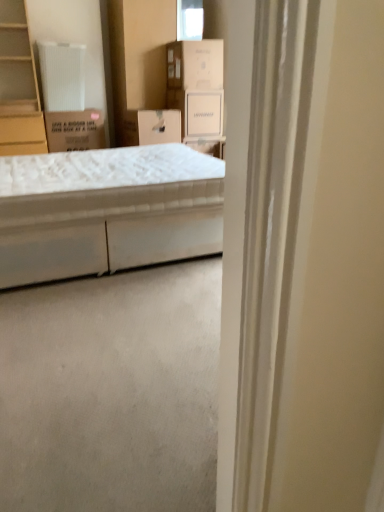
How much space does brown cardboard box at upper left, marked as the second cardboard box in a right-to-left arrangement, occupy vertically?

brown cardboard box at upper left, marked as the second cardboard box in a right-to-left arrangement, is 42.87 centimeters tall.

Locate an element on the screen. This screenshot has width=384, height=512. brown cardboard box at upper left, which is counted as the first cardboard box, starting from the left is located at coordinates (75, 130).

Locate an element on the screen. This screenshot has height=512, width=384. light brown wood cabinet at left is located at coordinates (18, 85).

What is the approximate height of white fabric bed at center?

21.80 inches.

The height and width of the screenshot is (512, 384). What do you see at coordinates (204, 113) in the screenshot? I see `white cardboard box at upper center, which appears as the 2th storage box when viewed from the left` at bounding box center [204, 113].

The height and width of the screenshot is (512, 384). Find the location of `white cardboard box at center, the first storage box from the left`. white cardboard box at center, the first storage box from the left is located at coordinates (159, 126).

Which object is positioned more to the right, white cardboard box at center, the first storage box from the left, or white fabric bed at center?

Positioned to the right is white cardboard box at center, the first storage box from the left.

Which of these two, white cardboard box at center, which is the 2th storage box in right-to-left order, or white fabric bed at center, is thinner?

Thinner between the two is white cardboard box at center, which is the 2th storage box in right-to-left order.

Is white cardboard box at upper center, which is the 2th cardboard box in left-to-right order, at the back of white cardboard box at upper center, which appears as the 1th storage box when viewed from the right?

No, white cardboard box at upper center, which appears as the 1th storage box when viewed from the right,'s orientation is not away from white cardboard box at upper center, which is the 2th cardboard box in left-to-right order.

From a real-world perspective, is white cardboard box at upper center, which appears as the 1th storage box when viewed from the right, positioned above or below white cardboard box at upper center, the 1th cardboard box from the right?

Clearly, from a real-world perspective, white cardboard box at upper center, which appears as the 1th storage box when viewed from the right, is below white cardboard box at upper center, the 1th cardboard box from the right.

This screenshot has height=512, width=384. Find the location of `the 1st cardboard box counting from the left side of the white cardboard box at upper center, which appears as the 2th storage box when viewed from the left`. the 1st cardboard box counting from the left side of the white cardboard box at upper center, which appears as the 2th storage box when viewed from the left is located at coordinates (195, 64).

Which is more to the right, white cardboard box at upper center, which appears as the 2th storage box when viewed from the left, or white cardboard box at upper center, the 2th cardboard box in the bottom-to-top sequence?

white cardboard box at upper center, which appears as the 2th storage box when viewed from the left, is more to the right.

Between white cardboard box at upper center, positioned as the first cardboard box in top-to-bottom order, and brown cardboard box at upper left, marked as the second cardboard box in a right-to-left arrangement, which one has smaller size?

white cardboard box at upper center, positioned as the first cardboard box in top-to-bottom order.

From the image's perspective, is white cardboard box at upper center, the 2th cardboard box in the bottom-to-top sequence, positioned above or below brown cardboard box at upper left, marked as the second cardboard box in a right-to-left arrangement?

Based on their image positions, white cardboard box at upper center, the 2th cardboard box in the bottom-to-top sequence, is located above brown cardboard box at upper left, marked as the second cardboard box in a right-to-left arrangement.

Identify the location of cardboard box behind the white cardboard box at upper center, which is the 2th cardboard box in left-to-right order. The height and width of the screenshot is (512, 384). (75, 130).

Is white cardboard box at upper center, the 2th cardboard box in the bottom-to-top sequence, not inside brown cardboard box at upper left, marked as the second cardboard box in a right-to-left arrangement?

Indeed, white cardboard box at upper center, the 2th cardboard box in the bottom-to-top sequence, is completely outside brown cardboard box at upper left, marked as the second cardboard box in a right-to-left arrangement.

Is light brown wood cabinet at left far from white fabric bed at center?

Indeed, light brown wood cabinet at left is not near white fabric bed at center.

Is light brown wood cabinet at left bigger than white fabric bed at center?

No, light brown wood cabinet at left is not bigger than white fabric bed at center.

Is light brown wood cabinet at left positioned with its back to white fabric bed at center?

No, white fabric bed at center is not at the back of light brown wood cabinet at left.

From the image's perspective, which one is positioned lower, light brown wood cabinet at left or brown cardboard box at upper left, which is counted as the first cardboard box, starting from the left?

brown cardboard box at upper left, which is counted as the first cardboard box, starting from the left, appears lower in the image.

Between light brown wood cabinet at left and brown cardboard box at upper left, the second cardboard box positioned from the top, which one has smaller width?

Thinner between the two is brown cardboard box at upper left, the second cardboard box positioned from the top.

In terms of height, does light brown wood cabinet at left look taller or shorter compared to brown cardboard box at upper left, the first cardboard box from the bottom?

Considering their sizes, light brown wood cabinet at left has more height than brown cardboard box at upper left, the first cardboard box from the bottom.

Between light brown wood cabinet at left and brown cardboard box at upper left, the first cardboard box from the bottom, which one appears on the right side from the viewer's perspective?

brown cardboard box at upper left, the first cardboard box from the bottom.

From the image's perspective, which object appears higher, light brown wood cabinet at left or white cardboard box at center, which is the 2th storage box in right-to-left order?

From the image's view, light brown wood cabinet at left is above.

Do you think light brown wood cabinet at left is within white cardboard box at center, the first storage box from the left, or outside of it?

light brown wood cabinet at left is outside white cardboard box at center, the first storage box from the left.

Does light brown wood cabinet at left have a larger size compared to white cardboard box at center, which is the 2th storage box in right-to-left order?

Indeed, light brown wood cabinet at left has a larger size compared to white cardboard box at center, which is the 2th storage box in right-to-left order.

Between white cardboard box at center, which is the 2th storage box in right-to-left order, and white cardboard box at upper center, which appears as the 2th storage box when viewed from the left, which one has smaller size?

Smaller between the two is white cardboard box at upper center, which appears as the 2th storage box when viewed from the left.

From the image's perspective, which one is positioned higher, white cardboard box at center, the first storage box from the left, or white cardboard box at upper center, which appears as the 2th storage box when viewed from the left?

white cardboard box at upper center, which appears as the 2th storage box when viewed from the left, is shown above in the image.

Does white cardboard box at center, which is the 2th storage box in right-to-left order, have a lesser height compared to white cardboard box at upper center, which appears as the 2th storage box when viewed from the left?

Yes, white cardboard box at center, which is the 2th storage box in right-to-left order, is shorter than white cardboard box at upper center, which appears as the 2th storage box when viewed from the left.

Is white cardboard box at center, the first storage box from the left, spatially inside white cardboard box at upper center, which appears as the 2th storage box when viewed from the left, or outside of it?

white cardboard box at center, the first storage box from the left, lies outside white cardboard box at upper center, which appears as the 2th storage box when viewed from the left.

You are a GUI agent. You are given a task and a screenshot of the screen. Output one action in this format:
    pyautogui.click(x=<x>, y=<y>)
    Task: Click on the bed in front of the white cardboard box at center, the first storage box from the left
    
    Given the screenshot: What is the action you would take?
    pyautogui.click(x=107, y=211)

The width and height of the screenshot is (384, 512). Find the location of `storage box located on the right of white cardboard box at upper center, positioned as the first cardboard box in top-to-bottom order`. storage box located on the right of white cardboard box at upper center, positioned as the first cardboard box in top-to-bottom order is located at coordinates (204, 113).

From the picture: Estimate the real-world distances between objects in this image. Which object is closer to white fabric bed at center, white cardboard box at upper center, which is the 2th cardboard box in left-to-right order, or brown cardboard box at upper left, the second cardboard box positioned from the top?

brown cardboard box at upper left, the second cardboard box positioned from the top, is positioned closer to the anchor white fabric bed at center.

Based on their spatial positions, is white fabric bed at center or brown cardboard box at upper left, marked as the second cardboard box in a right-to-left arrangement, further from white cardboard box at upper center, the 1th cardboard box from the right?

white fabric bed at center is further to white cardboard box at upper center, the 1th cardboard box from the right.

Looking at the image, which one is located further to white cardboard box at upper center, which appears as the 1th storage box when viewed from the right, white cardboard box at center, the first storage box from the left, or light brown wood cabinet at left?

light brown wood cabinet at left lies further to white cardboard box at upper center, which appears as the 1th storage box when viewed from the right, than the other object.

Estimate the real-world distances between objects in this image. Which object is closer to white fabric bed at center, white cardboard box at center, which is the 2th storage box in right-to-left order, or light brown wood cabinet at left?

white cardboard box at center, which is the 2th storage box in right-to-left order, lies closer to white fabric bed at center than the other object.

Estimate the real-world distances between objects in this image. Which object is further from light brown wood cabinet at left, white cardboard box at upper center, which appears as the 2th storage box when viewed from the left, or white cardboard box at center, the first storage box from the left?

white cardboard box at upper center, which appears as the 2th storage box when viewed from the left, is further to light brown wood cabinet at left.

Which object lies nearer to the anchor point light brown wood cabinet at left, white cardboard box at upper center, which is the 2th cardboard box in left-to-right order, or white fabric bed at center?

Based on the image, white cardboard box at upper center, which is the 2th cardboard box in left-to-right order, appears to be nearer to light brown wood cabinet at left.

Looking at the image, which one is located closer to white fabric bed at center, light brown wood cabinet at left or white cardboard box at upper center, which appears as the 2th storage box when viewed from the left?

The object closer to white fabric bed at center is white cardboard box at upper center, which appears as the 2th storage box when viewed from the left.

From the image, which object appears to be farther from brown cardboard box at upper left, the second cardboard box positioned from the top, white cardboard box at upper center, which is the 2th cardboard box in left-to-right order, or white cardboard box at center, the first storage box from the left?

white cardboard box at upper center, which is the 2th cardboard box in left-to-right order, is positioned further to the anchor brown cardboard box at upper left, the second cardboard box positioned from the top.

Find the location of a particular element. Image resolution: width=384 pixels, height=512 pixels. storage box between white fabric bed at center and brown cardboard box at upper left, the second cardboard box positioned from the top, from front to back is located at coordinates (159, 126).

This screenshot has height=512, width=384. What are the coordinates of `cabinet positioned between white fabric bed at center and white cardboard box at upper center, which appears as the 1th storage box when viewed from the right, from near to far` in the screenshot? It's located at (18, 85).

Identify the location of cabinet positioned between white fabric bed at center and white cardboard box at upper center, the 1th cardboard box from the right, from near to far. The width and height of the screenshot is (384, 512). (18, 85).

The image size is (384, 512). I want to click on cardboard box between white fabric bed at center and brown cardboard box at upper left, the first cardboard box from the bottom, along the z-axis, so click(195, 64).